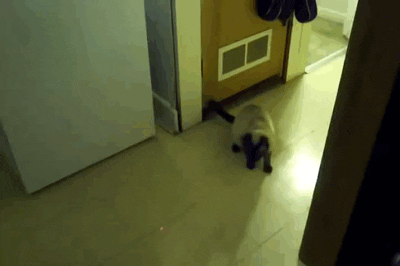
Image resolution: width=400 pixels, height=266 pixels. Find the location of `gap under door`. gap under door is located at coordinates coord(192,95).